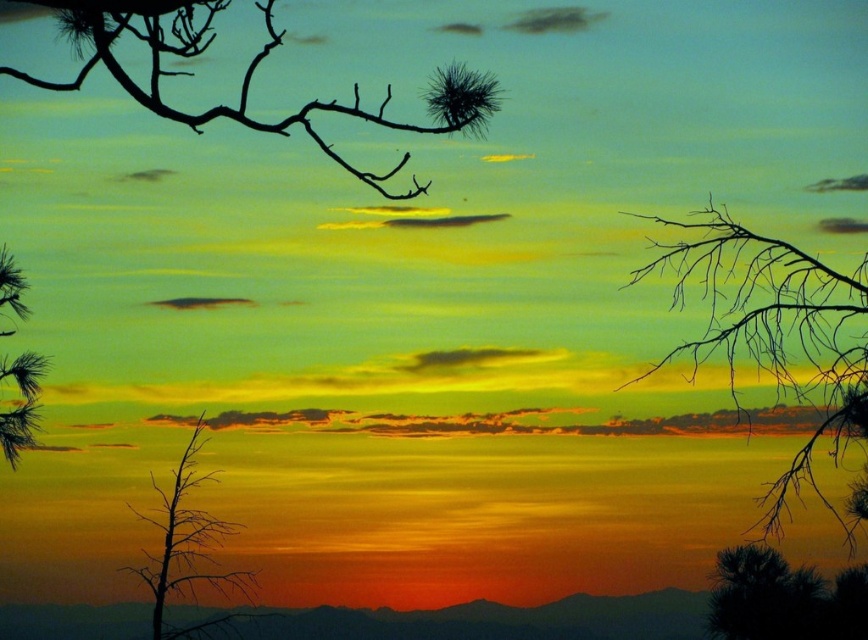
Does silhouette pine tree at lower right appear on the right side of silvery pine branch at left?

Indeed, silhouette pine tree at lower right is positioned on the right side of silvery pine branch at left.

Who is higher up, silhouette pine tree at lower right or silvery pine branch at left?

silvery pine branch at left is higher up.

Between point (865, 566) and point (5, 371), which one is positioned behind?

Point (5, 371)

Identify the location of silhouette pine tree at lower right. The height and width of the screenshot is (640, 868). (783, 598).

Is silhouette branch at upper right bigger than silhouette pine tree at lower right?

Yes, silhouette branch at upper right is bigger than silhouette pine tree at lower right.

Between point (810, 300) and point (820, 634), which one is positioned behind?

The point (820, 634) is more distant.

The height and width of the screenshot is (640, 868). I want to click on silhouette branch at upper right, so click(x=774, y=333).

Which is in front, point (275, 131) or point (10, 276)?

Positioned in front is point (275, 131).

Who is positioned more to the left, black matte branch at upper left or silvery pine branch at left?

Positioned to the left is silvery pine branch at left.

Between point (112, 19) and point (12, 332), which one is positioned in front?

Point (112, 19) is in front.

This screenshot has width=868, height=640. What are the coordinates of `black matte branch at upper left` in the screenshot? It's located at (247, 74).